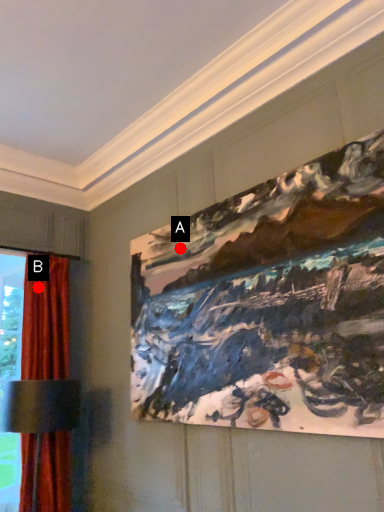
Question: Two points are circled on the image, labeled by A and B beside each circle. Which point is farther to the camera?

Choices:
 (A) A is further
 (B) B is further

Answer: (B)